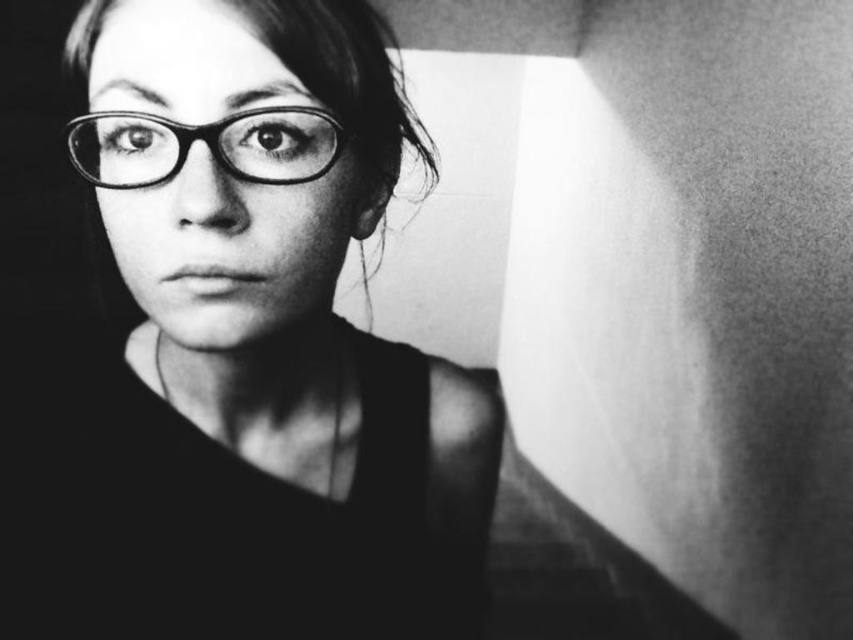
You are a photographer analyzing the composition of this portrait. You notice a point at coordinates (x=242, y=356). Based on the scene description, where is this point located in relation to the glasses?

The point at coordinates (x=242, y=356) is located on the matte black glasses at upper left.